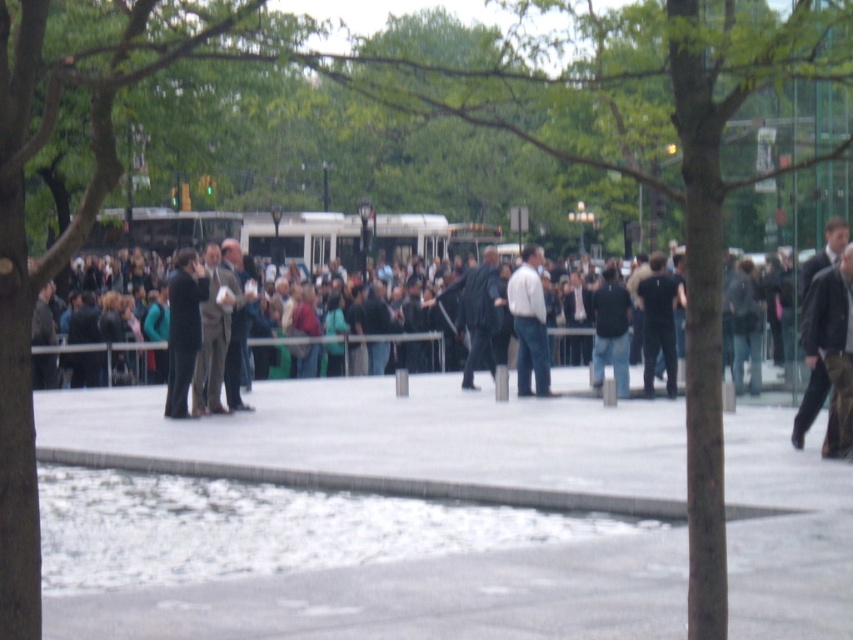
Question: Which object appears farthest from the camera in this image?

Choices:
 (A) dark gray jacket at center
 (B) dark suit at center
 (C) dark brown leather jacket at center

Answer: (A)

Question: Is white shirt at center further to the viewer compared to black matte shirt at center?

Choices:
 (A) no
 (B) yes

Answer: (A)

Question: Which point is closer to the camera?

Choices:
 (A) (532, 304)
 (B) (184, 406)

Answer: (B)

Question: Can you confirm if dark brown leather jacket at center is wider than white shirt at center?

Choices:
 (A) no
 (B) yes

Answer: (A)

Question: Can you confirm if dark suit at center is thinner than black matte shirt at center?

Choices:
 (A) no
 (B) yes

Answer: (B)

Question: Among these points, which one is farthest from the camera?

Choices:
 (A) (672, 288)
 (B) (606, 320)
 (C) (527, 371)

Answer: (B)